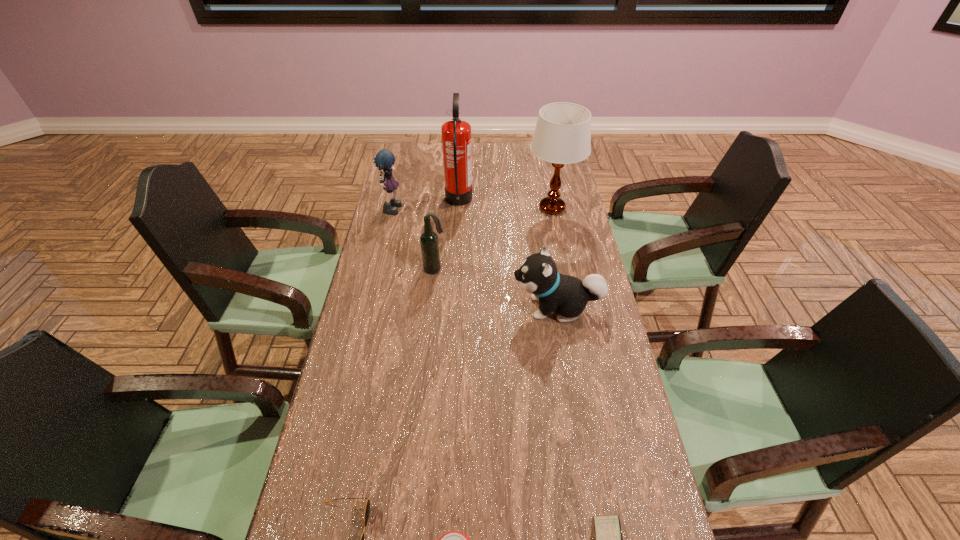
Locate an element on the screen. The image size is (960, 540). free location located at the face of the puppy is located at coordinates (435, 307).

The height and width of the screenshot is (540, 960). I want to click on free space located 0.150m at the face of the puppy, so (466, 307).

The width and height of the screenshot is (960, 540). I want to click on object situated at the left edge, so click(x=384, y=159).

Identify the location of table lamp at the right edge. Image resolution: width=960 pixels, height=540 pixels. (562, 135).

The height and width of the screenshot is (540, 960). In order to click on puppy positioned at the right edge in this screenshot , I will do `click(538, 275)`.

This screenshot has width=960, height=540. I want to click on free space at the far edge of the desktop, so click(513, 155).

Locate an element on the screen. Image resolution: width=960 pixels, height=540 pixels. free location at the left edge is located at coordinates (392, 326).

This screenshot has height=540, width=960. What are the coordinates of `vacant space at the right edge of the desktop` in the screenshot? It's located at (596, 318).

Identify the location of free space between the rag doll and the beer bottle. (414, 238).

Image resolution: width=960 pixels, height=540 pixels. In order to click on empty space between the fifth nearest object and the table lamp in this screenshot , I will do `click(493, 239)`.